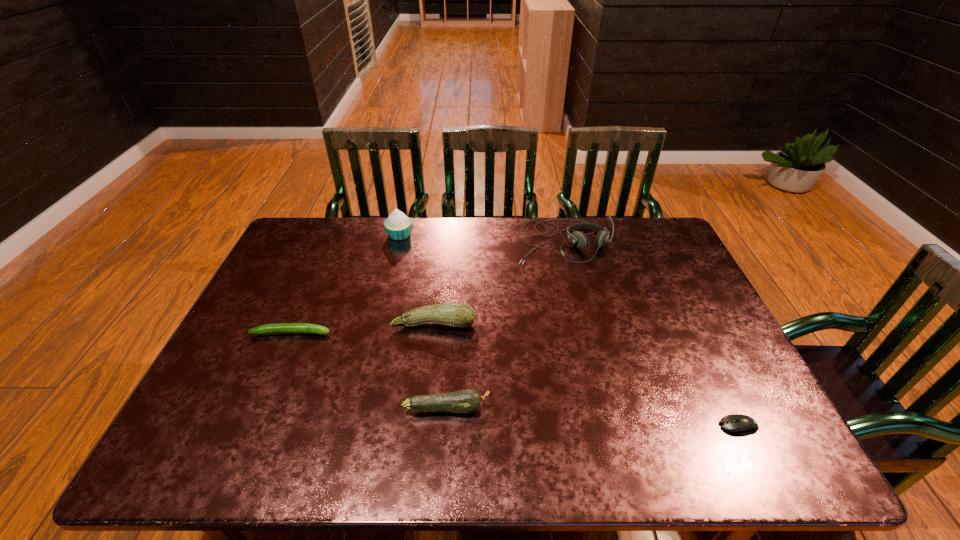
In order to click on zucchini that is the closest to the leftmost zucchini in this screenshot , I will do `click(453, 314)`.

Where is `zucchini that can be found as the third closest to the tallest object`? zucchini that can be found as the third closest to the tallest object is located at coordinates (x=469, y=400).

Find the location of a particular element. The width and height of the screenshot is (960, 540). vacant region that satisfies the following two spatial constraints: 1. on the outer surface of the second object from right to left; 2. at the blossom end of the third shortest object is located at coordinates (604, 408).